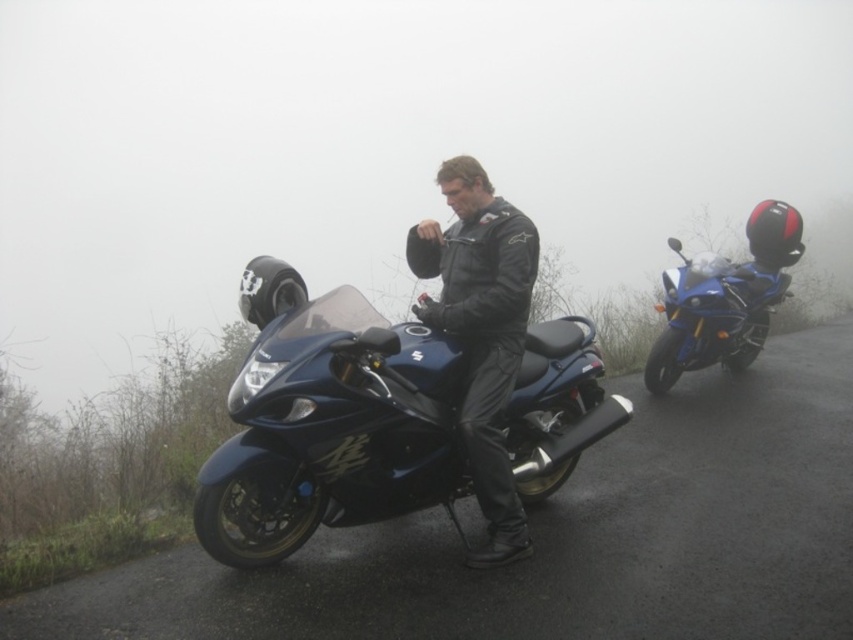
Question: In this image, where is glossy asphalt road at center located relative to black leather jacket at center?

Choices:
 (A) above
 (B) below

Answer: (B)

Question: Is glossy asphalt road at center smaller than black leather jacket at center?

Choices:
 (A) yes
 (B) no

Answer: (A)

Question: Estimate the real-world distances between objects in this image. Which object is closer to the glossy blue motorcycle at right?

Choices:
 (A) glossy black motorcycle at center
 (B) glossy asphalt road at center
 (C) black leather jacket at center

Answer: (A)

Question: Can you confirm if glossy asphalt road at center is thinner than glossy black motorcycle at center?

Choices:
 (A) no
 (B) yes

Answer: (B)

Question: Which object is closer to the camera taking this photo?

Choices:
 (A) black leather jacket at center
 (B) glossy asphalt road at center

Answer: (B)

Question: Which point is farther to the camera?

Choices:
 (A) (842, 417)
 (B) (480, 548)
 (C) (727, 365)
 (D) (421, 410)

Answer: (C)